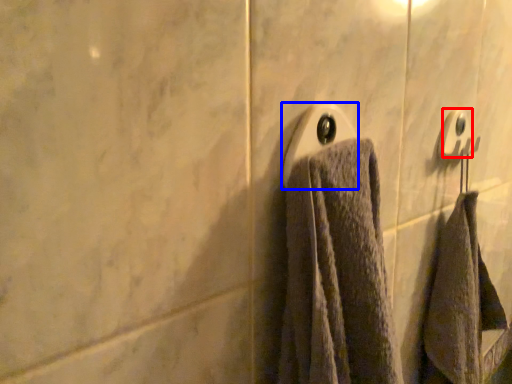
Question: Which of the following is the farthest to the observer, towel bar (highlighted by a red box) or towel bar (highlighted by a blue box)?

Choices:
 (A) towel bar
 (B) towel bar

Answer: (A)